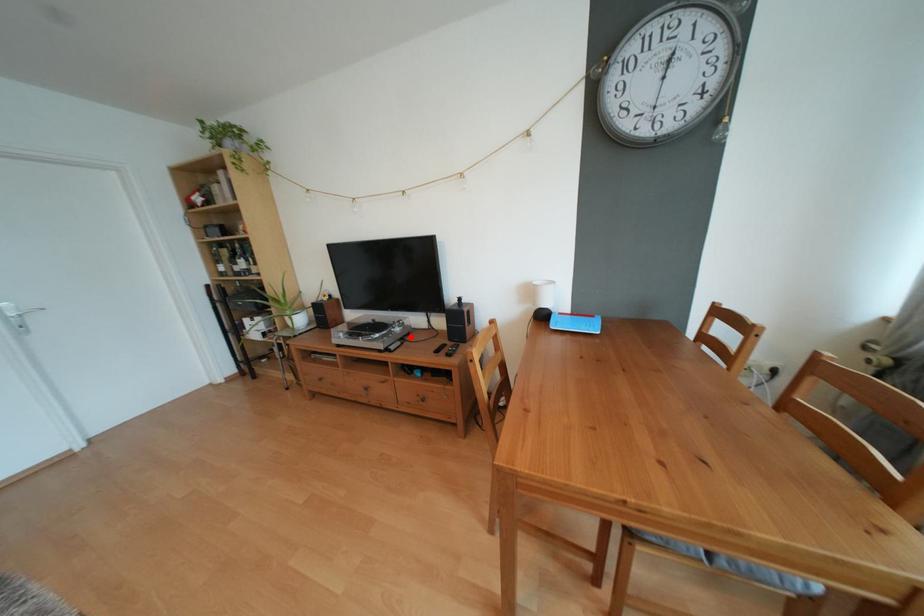
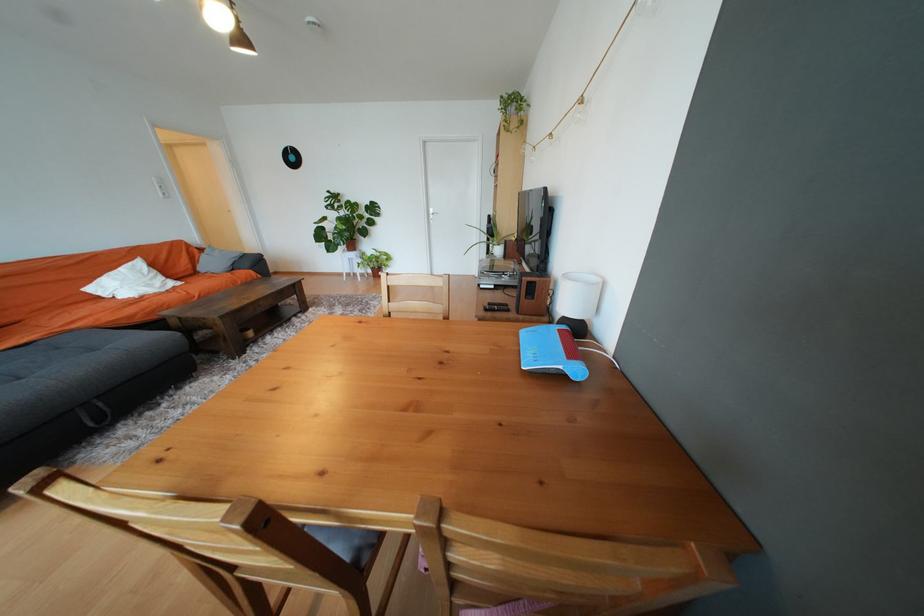
The point at the highlighted location is marked in the first image. Where is the corresponding point in the second image?

(517, 288)